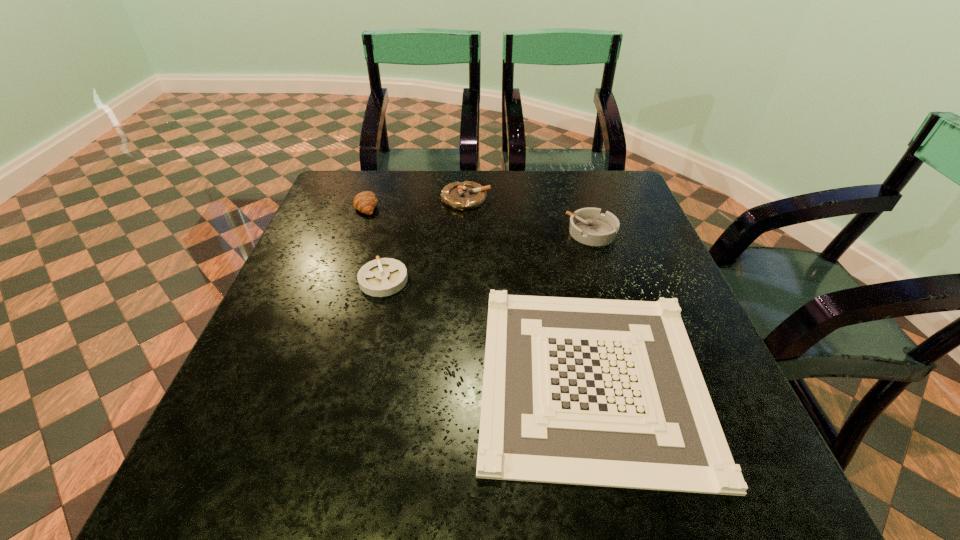
At what (x,y) coordinates should I click in order to perform the action: click on vacant point located between the shortest object and the crescent roll. Please return your answer as a coordinate pair (x, y). Looking at the image, I should click on (480, 291).

Find the location of a particular element. The width and height of the screenshot is (960, 540). object that is the closest to the second nearest ashtray is located at coordinates (598, 392).

Identify the location of object that stands as the third closest to the nearest ashtray. tap(467, 195).

Select which ashtray appears as the closest to the farthest ashtray. Please provide its 2D coordinates. Your answer should be formatted as a tuple, i.e. [(x, y)], where the tuple contains the x and y coordinates of a point satisfying the conditions above.

[(589, 226)]

Identify which ashtray is located as the nearest to the rightmost ashtray. Please provide its 2D coordinates. Your answer should be formatted as a tuple, i.e. [(x, y)], where the tuple contains the x and y coordinates of a point satisfying the conditions above.

[(467, 195)]

Locate an element on the screen. This screenshot has width=960, height=540. free location that satisfies the following two spatial constraints: 1. on the back side of the leftmost object; 2. on the left side of the farthest ashtray is located at coordinates (370, 199).